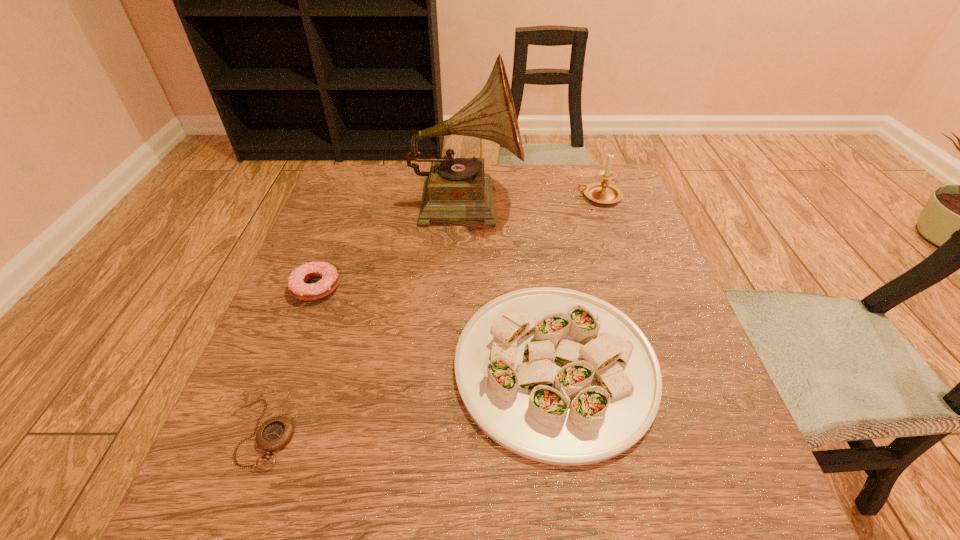
This screenshot has width=960, height=540. What are the coordinates of `the tallest object` in the screenshot? It's located at (456, 189).

The width and height of the screenshot is (960, 540). I want to click on candle holder, so click(602, 192).

Identify the location of platter. (558, 376).

Locate an element on the screen. The height and width of the screenshot is (540, 960). the second shortest object is located at coordinates (297, 286).

The image size is (960, 540). In order to click on pocket watch in this screenshot , I will do `click(275, 433)`.

Locate an element on the screen. free region located 0.280m from the horn of the tallest object is located at coordinates (626, 202).

Locate an element on the screen. This screenshot has height=540, width=960. free space located with a handle on the side of the fourth shortest object is located at coordinates (435, 197).

This screenshot has height=540, width=960. In order to click on free space located with a handle on the side of the fourth shortest object in this screenshot , I will do `click(472, 197)`.

Where is `free spot located with a handle on the side of the fourth shortest object`? This screenshot has width=960, height=540. free spot located with a handle on the side of the fourth shortest object is located at coordinates (520, 197).

What are the coordinates of `vacant area located 0.210m on the back of the platter` in the screenshot? It's located at (536, 231).